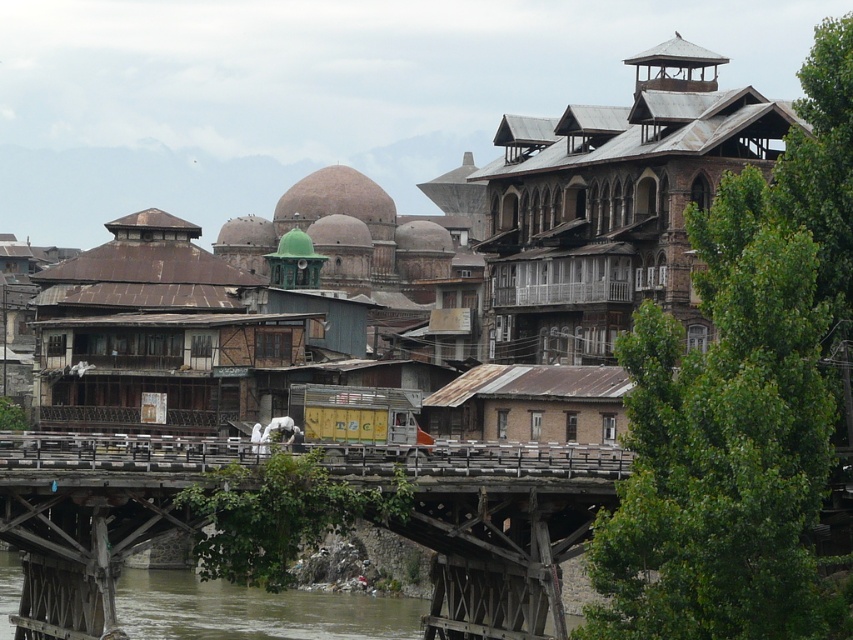
You are a tourist standing at the entrance of the mosque with a green dome on the left. You want to cross the river to reach the other side. Which direction should you head to find the rustic wooden bridge at center?

You should head towards the center of the scene to find the rustic wooden bridge at center, as it is located at point (537, 220) in the image.

You are a drone operator tasked with capturing aerial footage of the rustic wooden bridge at center. The bridge is at coordinates point 0.344, 0.630. To ensure safety, you must stay 50 meters away from the bridge. If your drone can fly up to 100 meters away from its starting position, what is the maximum distance you can fly towards the bridge while staying within the safety zone?

The rustic wooden bridge at center is located at point (537, 220). To stay within the 50 meter safety zone, the drone can fly up to 50 meters towards the bridge from its starting position, as exceeding this distance would bring it too close to the bridge. Since the drone can fly up to 100 meters, the maximum safe distance it can travel towards the bridge is 50 meters.